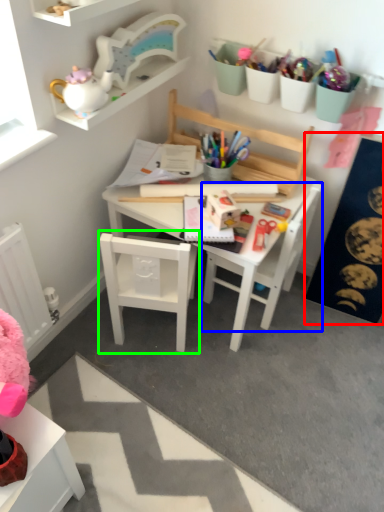
Question: Which is nearer to the bulletin board (highlighted by a red box)? chair (highlighted by a blue box) or chair (highlighted by a green box).

Choices:
 (A) chair
 (B) chair

Answer: (A)